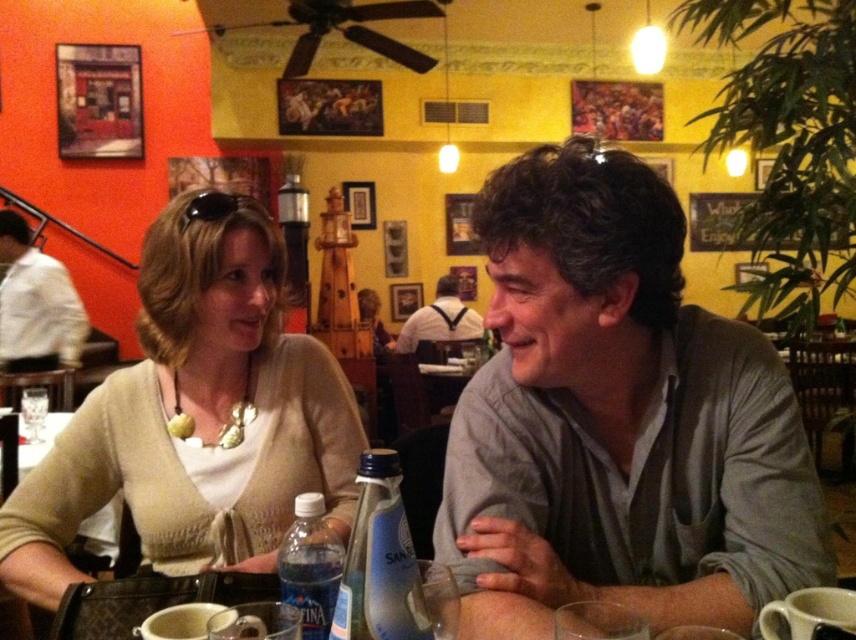
Please look at the image and locate the point at coordinates (622, 412). What object is positioned at this specific coordinate in the scene?

The gray matte shirt at center is located at the point (622, 412).

You are a waiter in the restaurant and need to deliver a drink to the person wearing the white shirt at left and the matte beige sweater at lower left. Which person is seated more to the left side of the table?

The white shirt at left is more to the left side of the table because it is positioned on the left side of the matte beige sweater at lower left.